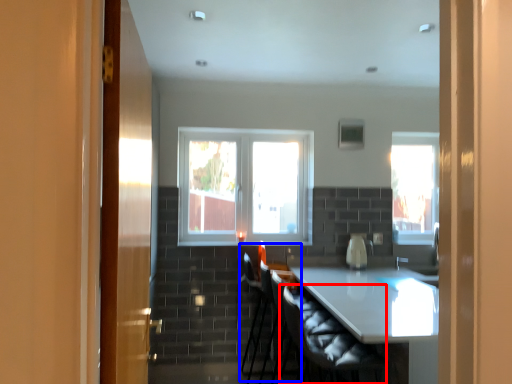
Question: Which object is further to the camera taking this photo, swivel chair (highlighted by a red box) or armchair (highlighted by a blue box)?

Choices:
 (A) swivel chair
 (B) armchair

Answer: (B)